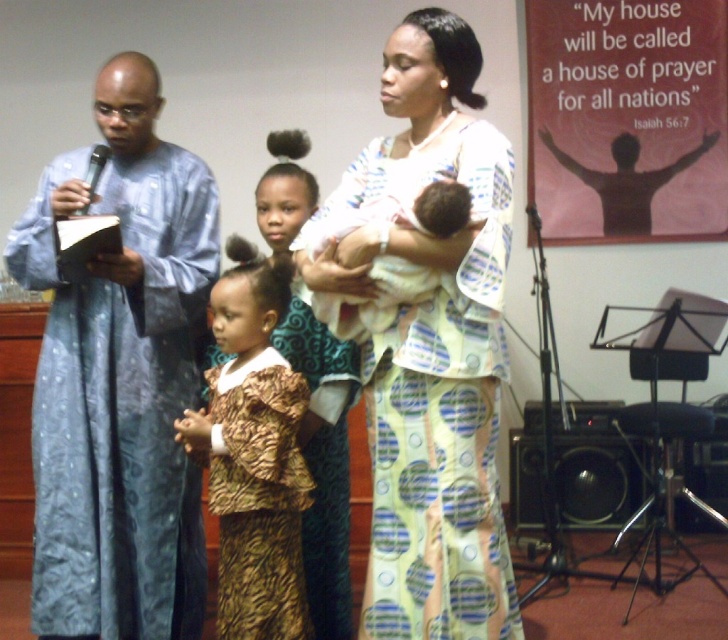
In the scene shown: You are an event planner setting up a photo shoot in the church. You need to place a backdrop behind the blue textured robe at left. Where should you position the backdrop to ensure it is centered behind the robe?

The blue textured robe at left is located at point (119, 378), so you should position the backdrop centered at those coordinates to align it properly behind the robe.

You are organizing a photo shoot and need to ensure that all clothing items are visible in the frame. Given that the blue textured robe at left and the brown textured dress at center are part of the scene, which clothing item requires more space in the frame to be fully visible?

The blue textured robe at left requires more space in the frame to be fully visible because it is bigger than the brown textured dress at center.